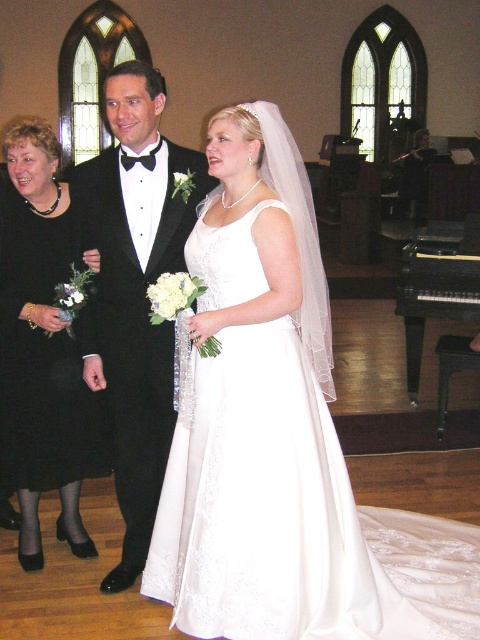
Question: Can you confirm if black satin tuxedo at center is positioned to the left of black polished wood piano at right?

Choices:
 (A) no
 (B) yes

Answer: (B)

Question: Is black satin dress at left to the right of black polished wood piano at right from the viewer's perspective?

Choices:
 (A) no
 (B) yes

Answer: (A)

Question: Which of the following is the farthest from the observer?

Choices:
 (A) black satin dress at left
 (B) white satin dress at center

Answer: (A)

Question: Can you confirm if white satin dress at center is positioned above black polished wood piano at right?

Choices:
 (A) no
 (B) yes

Answer: (A)

Question: Considering the real-world distances, which object is farthest from the black satin tuxedo at center?

Choices:
 (A) black polished wood piano at right
 (B) black satin dress at left

Answer: (A)

Question: Which object is the farthest from the black polished wood piano at right?

Choices:
 (A) black satin dress at left
 (B) white satin dress at center
 (C) black satin tuxedo at center

Answer: (A)